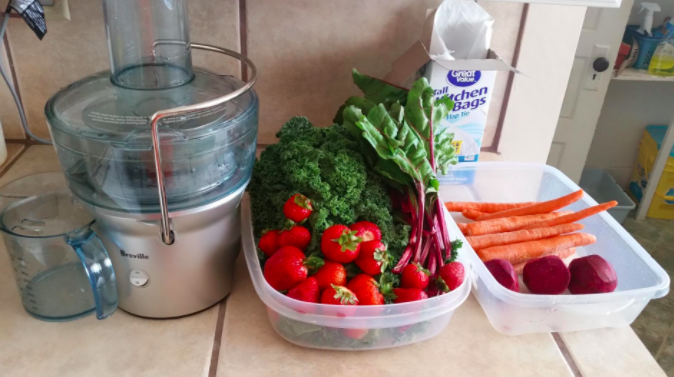
Identify the location of box of trash bags. Image resolution: width=674 pixels, height=377 pixels. (462, 77).